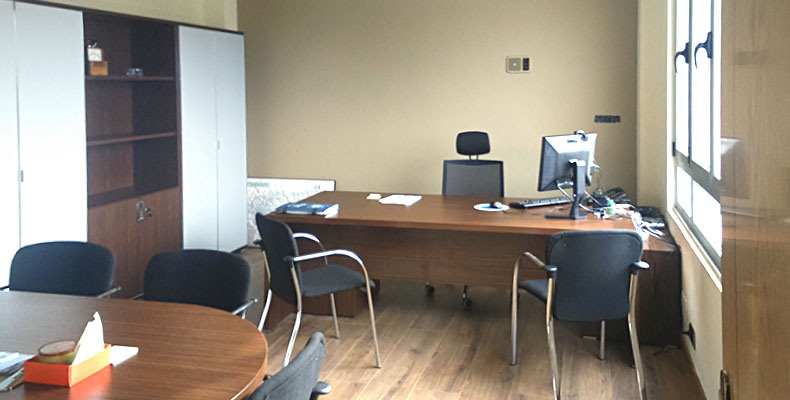
You are a GUI agent. You are given a task and a screenshot of the screen. Output one action in this format:
    pyautogui.click(x=<x>, y=<y>)
    Task: Click on the binder with blue cover
    
    Given the screenshot: What is the action you would take?
    pyautogui.click(x=310, y=206)